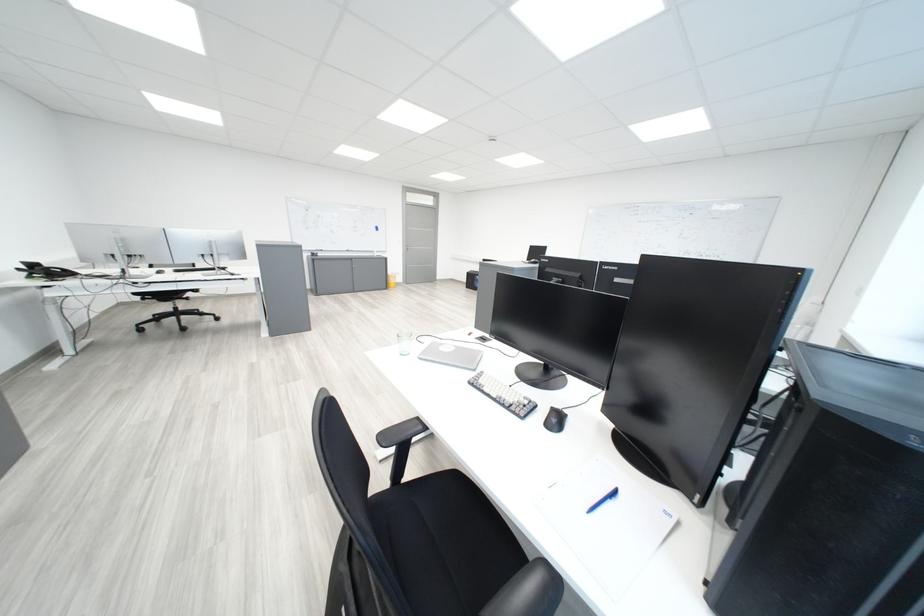
Locate an element on the screen. This screenshot has width=924, height=616. telephone handset is located at coordinates (55, 273).